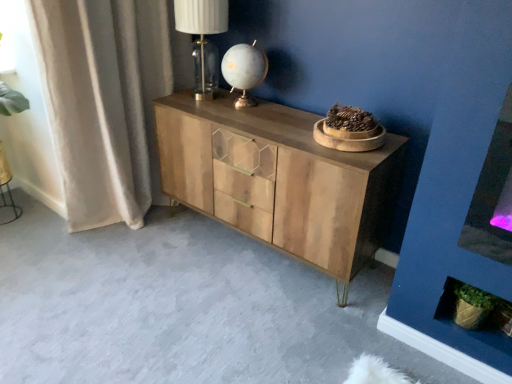
Question: Which direction should I rotate to look at matte glass table lamp at center, the 1th table lamp from the right?

Choices:
 (A) right
 (B) left

Answer: (B)

Question: From the image's perspective, is natural wood cabinet at center located beneath beige fabric curtain at left?

Choices:
 (A) yes
 (B) no

Answer: (A)

Question: Is natural wood cabinet at center to the right of beige fabric curtain at left from the viewer's perspective?

Choices:
 (A) no
 (B) yes

Answer: (B)

Question: Does natural wood cabinet at center have a smaller size compared to beige fabric curtain at left?

Choices:
 (A) no
 (B) yes

Answer: (A)

Question: Can we say natural wood cabinet at center lies outside beige fabric curtain at left?

Choices:
 (A) yes
 (B) no

Answer: (A)

Question: From a real-world perspective, is natural wood cabinet at center below beige fabric curtain at left?

Choices:
 (A) no
 (B) yes

Answer: (B)

Question: Is natural wood cabinet at center in contact with beige fabric curtain at left?

Choices:
 (A) no
 (B) yes

Answer: (A)

Question: Can you see translucent glass table lamp at upper center, arranged as the second table lamp when viewed from the right, touching natural wood cabinet at center?

Choices:
 (A) yes
 (B) no

Answer: (B)

Question: From a real-world perspective, is translucent glass table lamp at upper center, which appears as the first table lamp when viewed from the left, over natural wood cabinet at center?

Choices:
 (A) yes
 (B) no

Answer: (A)

Question: Is translucent glass table lamp at upper center, which appears as the first table lamp when viewed from the left, at the left side of natural wood cabinet at center?

Choices:
 (A) no
 (B) yes

Answer: (B)

Question: Is natural wood cabinet at center a part of translucent glass table lamp at upper center, arranged as the second table lamp when viewed from the right?

Choices:
 (A) yes
 (B) no

Answer: (B)

Question: Is translucent glass table lamp at upper center, arranged as the second table lamp when viewed from the right, located outside natural wood cabinet at center?

Choices:
 (A) no
 (B) yes

Answer: (B)

Question: Is translucent glass table lamp at upper center, arranged as the second table lamp when viewed from the right, to the right of natural wood cabinet at center from the viewer's perspective?

Choices:
 (A) no
 (B) yes

Answer: (A)

Question: Can you confirm if beige fabric curtain at left is bigger than translucent glass table lamp at upper center, arranged as the second table lamp when viewed from the right?

Choices:
 (A) no
 (B) yes

Answer: (B)